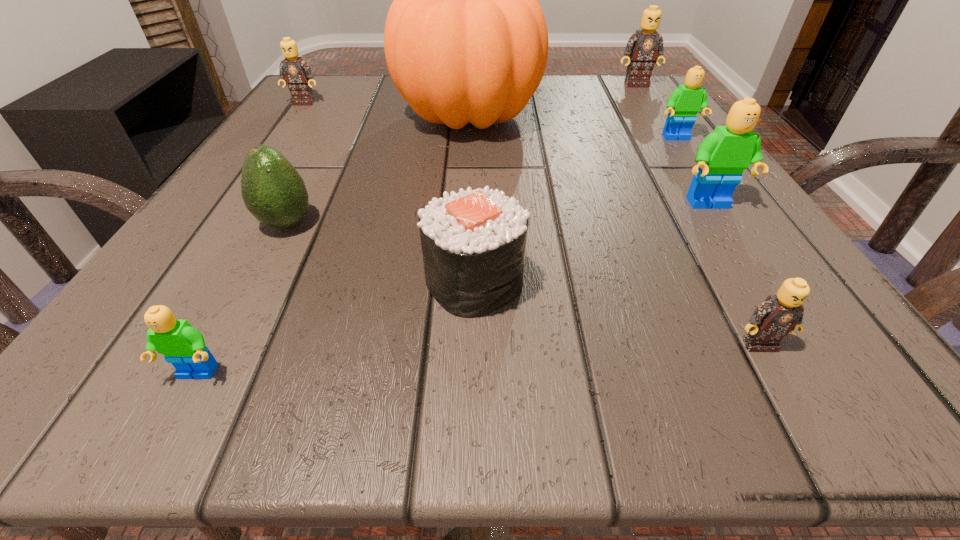
I want to click on orange pumpkin, so [465, 39].

Identify the location of pumpkin. (465, 39).

Locate an element on the screen. The image size is (960, 540). the biggest tan Lego is located at coordinates (643, 47).

Where is `the farthest Lego`? the farthest Lego is located at coordinates (643, 47).

The height and width of the screenshot is (540, 960). Identify the location of the second farthest green Lego. (723, 155).

Locate an element on the screen. The image size is (960, 540). the fourth farthest Lego is located at coordinates (723, 155).

This screenshot has height=540, width=960. What are the coordinates of `the second farthest tan Lego` in the screenshot? It's located at (297, 73).

I want to click on the second farthest Lego, so click(297, 73).

You are a GUI agent. You are given a task and a screenshot of the screen. Output one action in this format:
    pyautogui.click(x=<x>, y=<y>)
    Task: Click on the farthest green Lego
    The image size is (960, 540).
    Given the screenshot: What is the action you would take?
    pyautogui.click(x=684, y=103)

Image resolution: width=960 pixels, height=540 pixels. What are the coordinates of `the fourth nearest Lego` in the screenshot? It's located at point(684,103).